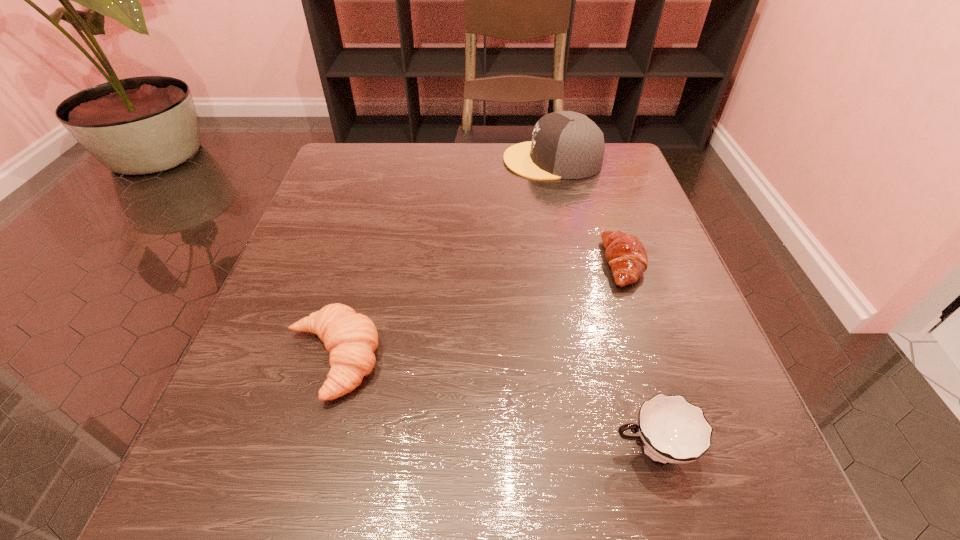
Image resolution: width=960 pixels, height=540 pixels. Identify the location of unoccupied position between the nearest object and the third nearest object. (637, 356).

In order to click on free spot between the second nearest object and the farthest object in this screenshot , I will do `click(442, 260)`.

The width and height of the screenshot is (960, 540). I want to click on vacant space in between the nearer crescent roll and the shortest object, so click(477, 312).

Locate an element on the screen. The height and width of the screenshot is (540, 960). empty space that is in between the farther crescent roll and the cap is located at coordinates (588, 212).

Identify the location of blank region between the nearer crescent roll and the cup. (492, 405).

This screenshot has width=960, height=540. Identify the location of free space that is in between the nearest object and the farthest object. (x=602, y=305).

Locate an element on the screen. This screenshot has width=960, height=540. free space between the farther crescent roll and the cap is located at coordinates pos(588,212).

You are a GUI agent. You are given a task and a screenshot of the screen. Output one action in this format:
    pyautogui.click(x=<x>, y=<y>)
    Task: Click on the vacant space that is in between the second nearest object and the farthest object
    
    Given the screenshot: What is the action you would take?
    pyautogui.click(x=442, y=260)

Find the location of a particular element. The width and height of the screenshot is (960, 540). free point between the nearest object and the left crescent roll is located at coordinates (492, 405).

The image size is (960, 540). What are the coordinates of `object that ranks as the closest to the tallest object` in the screenshot? It's located at (625, 254).